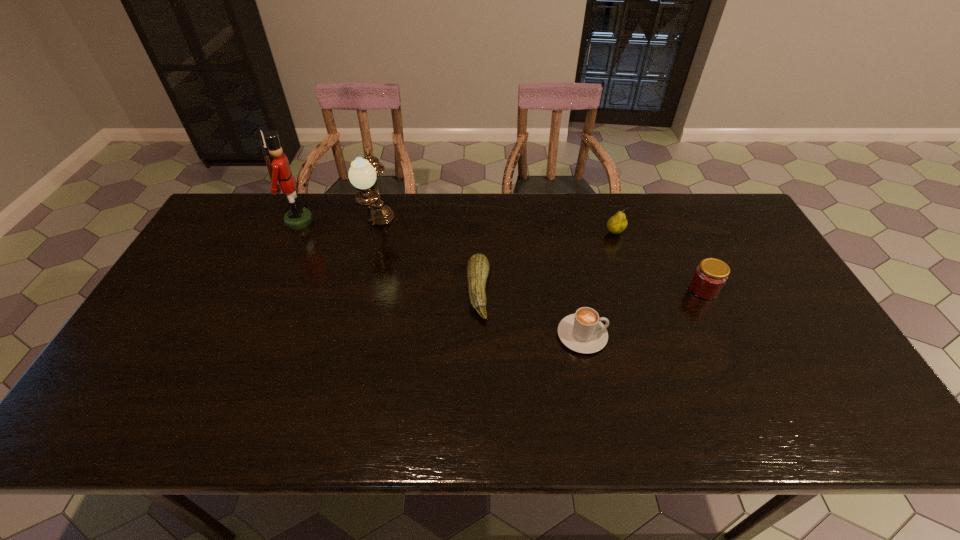
Where is `vacant space that satisfies the following two spatial constraints: 1. on the front-facing side of the tallest object; 2. on the left side of the pear`? The image size is (960, 540). vacant space that satisfies the following two spatial constraints: 1. on the front-facing side of the tallest object; 2. on the left side of the pear is located at coordinates (294, 233).

Find the location of `free space that satisfies the following two spatial constraints: 1. on the front-facing side of the rightmost object; 2. on the right side of the leftmost object`. free space that satisfies the following two spatial constraints: 1. on the front-facing side of the rightmost object; 2. on the right side of the leftmost object is located at coordinates (269, 289).